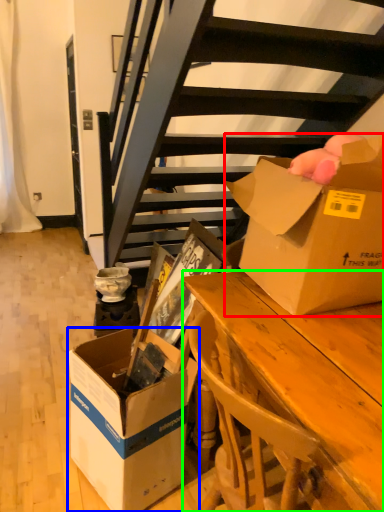
Question: Which object is the farthest from box (highlighted by a red box)? Choose among these: box (highlighted by a blue box) or desk (highlighted by a green box).

Choices:
 (A) box
 (B) desk

Answer: (A)